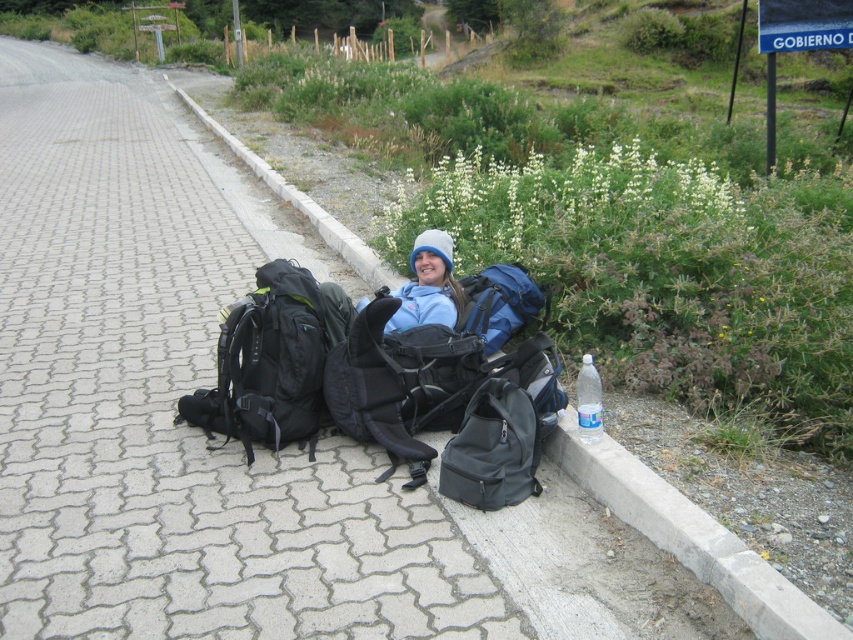
Question: Which point is farther from the camera taking this photo?

Choices:
 (A) (293, 310)
 (B) (778, 593)
 (C) (402, 305)

Answer: (C)

Question: Estimate the real-world distances between objects in this image. Which object is farther from the black matte backpack at center?

Choices:
 (A) blue fleece jacket at center
 (B) blue fabric backpack at center

Answer: (B)

Question: Is concrete at lower center behind black fabric backpack at center?

Choices:
 (A) no
 (B) yes

Answer: (A)

Question: Where is matte black backpack at lower center located in relation to blue fleece jacket at center in the image?

Choices:
 (A) below
 (B) above

Answer: (A)

Question: In this image, where is matte black backpack at lower center located relative to blue fleece jacket at center?

Choices:
 (A) below
 (B) above

Answer: (A)

Question: Which is farther from the blue fleece jacket at center?

Choices:
 (A) paved stone pavement at center
 (B) black fabric backpack at center
 (C) clear plastic bottle at lower right

Answer: (A)